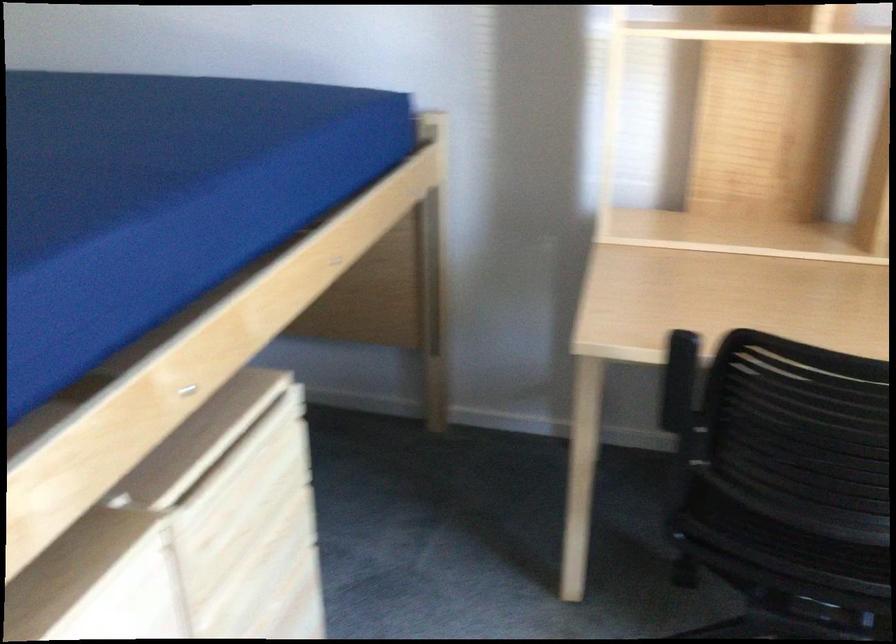
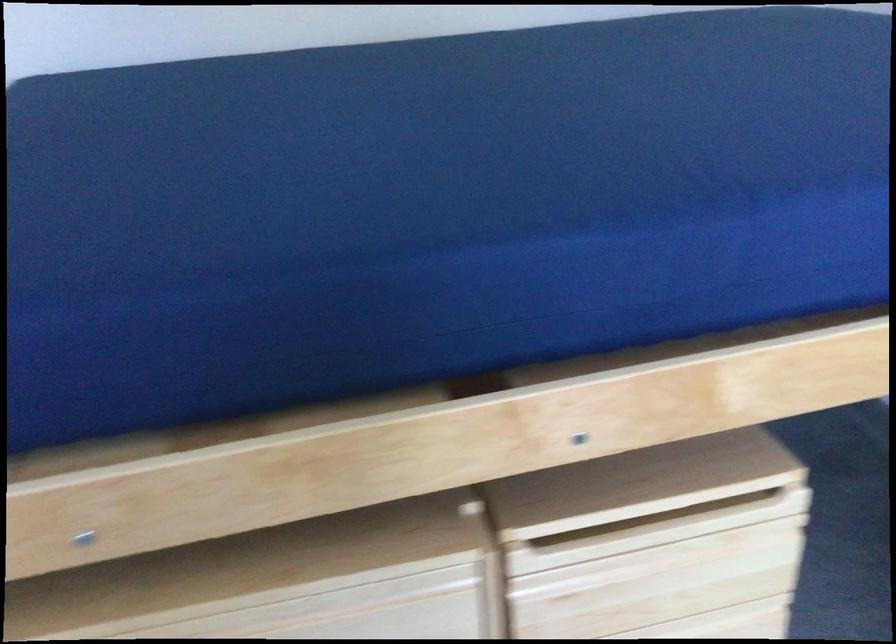
In the second image, find the point that corresponds to point 248,484 in the first image.

(668, 559)